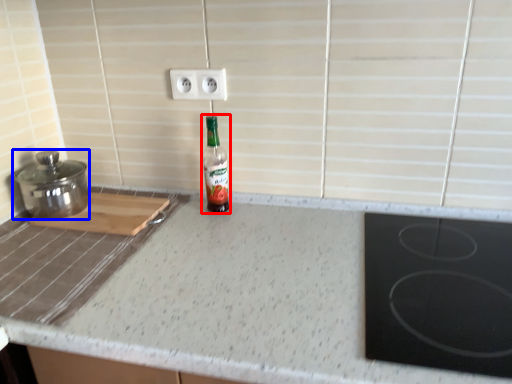
Question: Which point is further to the camera, bottle (highlighted by a red box) or kitchen appliance (highlighted by a blue box)?

Choices:
 (A) bottle
 (B) kitchen appliance

Answer: (A)